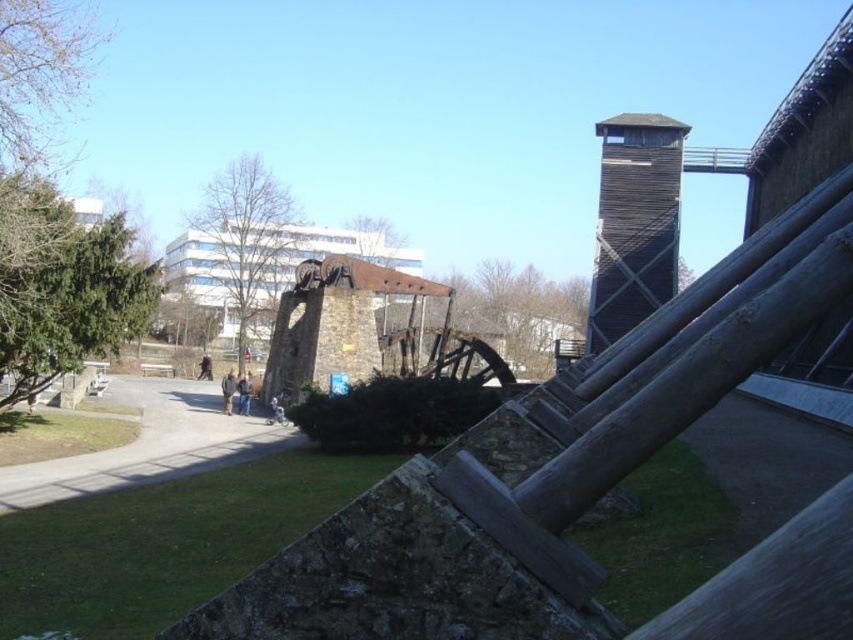
You are planning to set up a small picnic area in the outdoor scene. You have a picnic blanket that is 2 meters wide. The green grass at lower right and the gray concrete path at center are both available options. Which location would you choose to ensure the blanket fits entirely within the space?

The gray concrete path at center has a larger size than the green grass at lower right, so the picnic blanket would fit better on the gray concrete path at center.

You are standing at the entrance of the park and want to reach the green grass at lower right. Which direction should you walk relative to the gray concrete path at center?

The green grass at lower right is positioned on the right side of the gray concrete path at center, so you should walk to the right of the gray concrete path at center to reach it.

You are planning to install a new pathway connecting the green grass at lower right to the wooden tower at upper right. Given the distance between them, what is the minimum length of the pathway required to ensure it reaches both locations?

The minimum length of the pathway required to connect the green grass at lower right and the wooden tower at upper right should be at least 44.55 meters, as that is the distance between them.